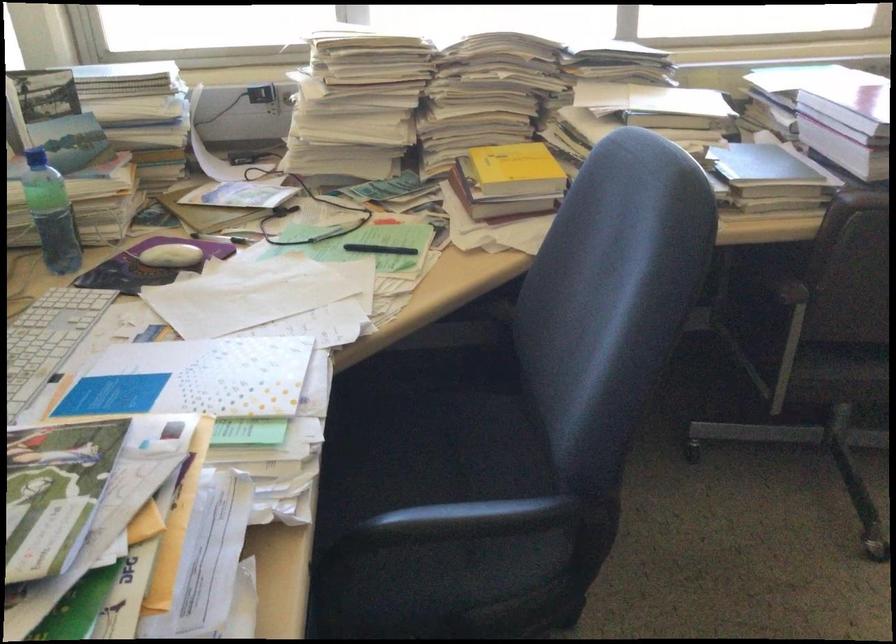
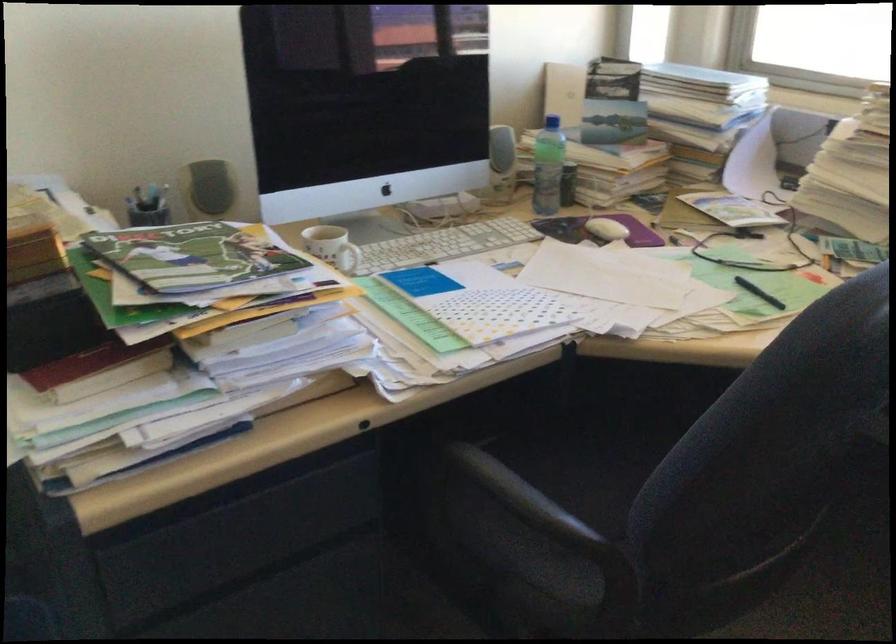
In the second image, find the point that corresponds to [184,254] in the first image.

(606, 229)